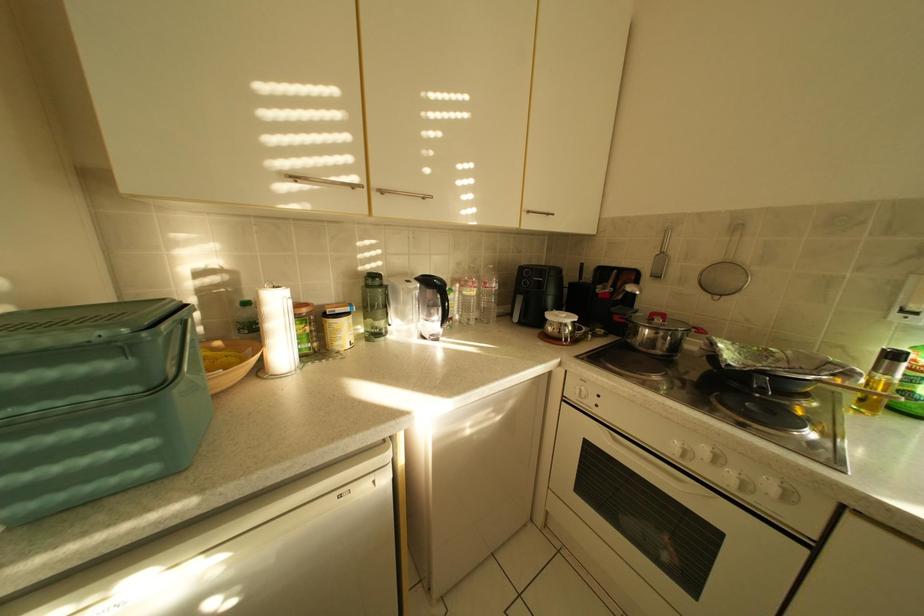
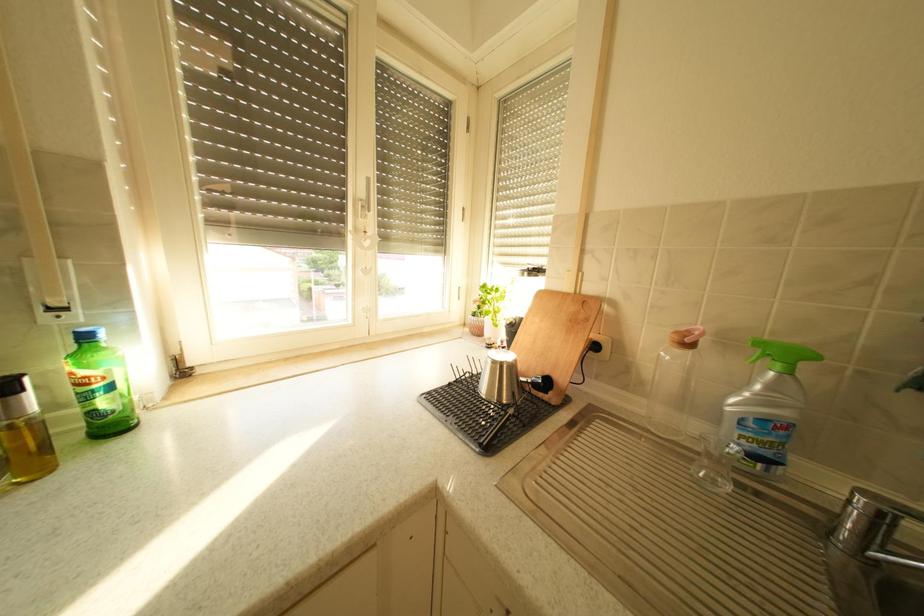
Question: Based on the continuous images, in which direction is the camera rotating? Reply with the corresponding letter.

Choices:
 (A) Left
 (B) Right
 (C) Up
 (D) Down

Answer: (B)